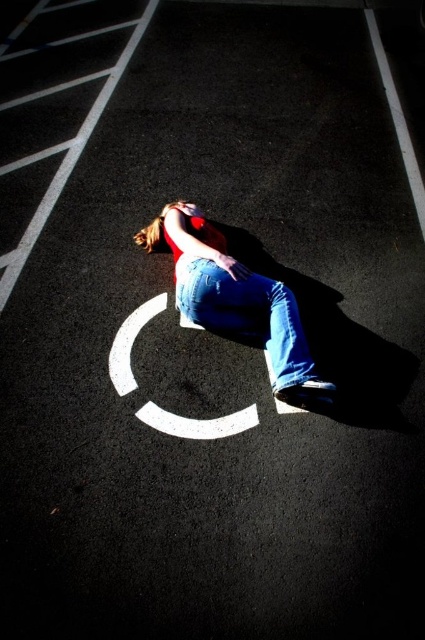
You are standing in a parking lot and want to take a photo of the point at coordinates point (158, 221). If your camera has a focal length of 50mm and you are currently 3 meters away from the point, should you move closer or farther away to focus properly?

The distance of point (158, 221) from camera is 3.57 meters. Since you are currently 3 meters away, you need to move slightly farther away to match the 3.57 meter distance for proper focus.

You are a photographer trying to capture the person lying on the ground in the parking lot. You want to ensure that both the denim jeans at center and the white painted circle at center are clearly visible in your shot. Given their sizes, which object should you focus on to ensure both are in frame without moving your camera?

The denim jeans at center is larger in size than the white painted circle at center. To ensure both are in frame, focus on the denim jeans at center since it is larger and will require a wider angle or closer proximity, thereby naturally including the smaller white painted circle at center within the shot.